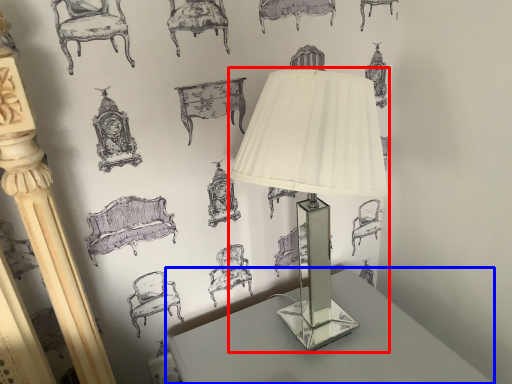
Question: Which of the following is the farthest to the observer, lamp (highlighted by a red box) or table (highlighted by a blue box)?

Choices:
 (A) lamp
 (B) table

Answer: (B)